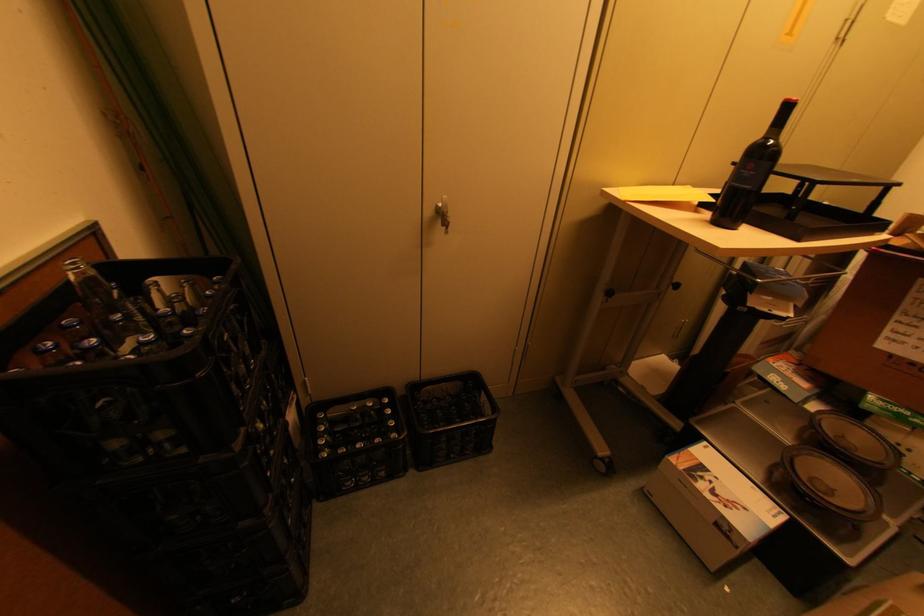
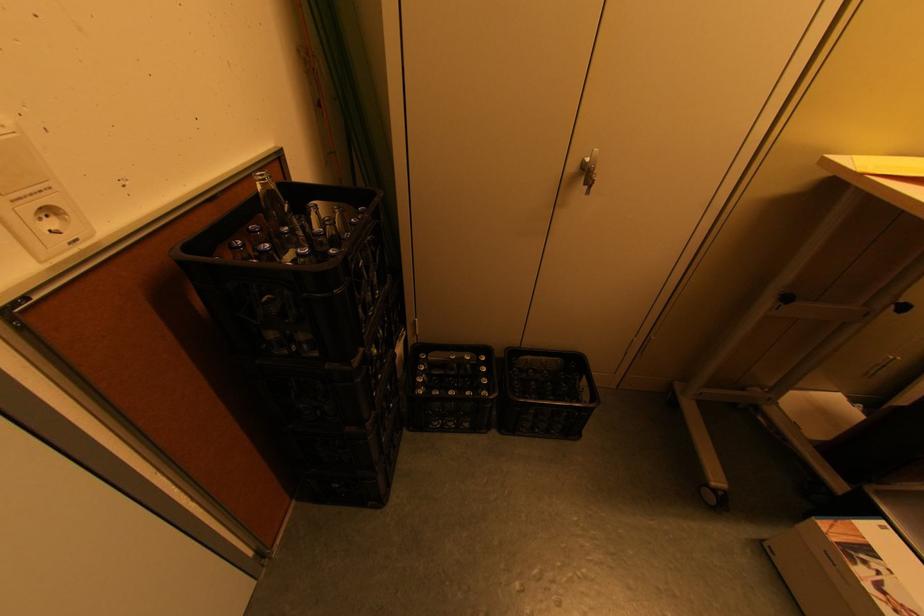
Find the pixel in the second image that matches pixel 481 399 in the first image.

(581, 381)